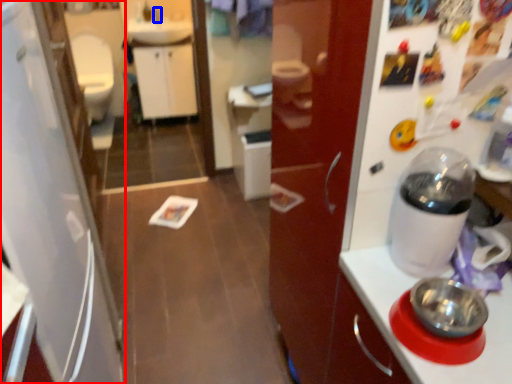
Question: Which of the following is the farthest to the observer, refrigerator (highlighted by a red box) or faucet (highlighted by a blue box)?

Choices:
 (A) refrigerator
 (B) faucet

Answer: (B)